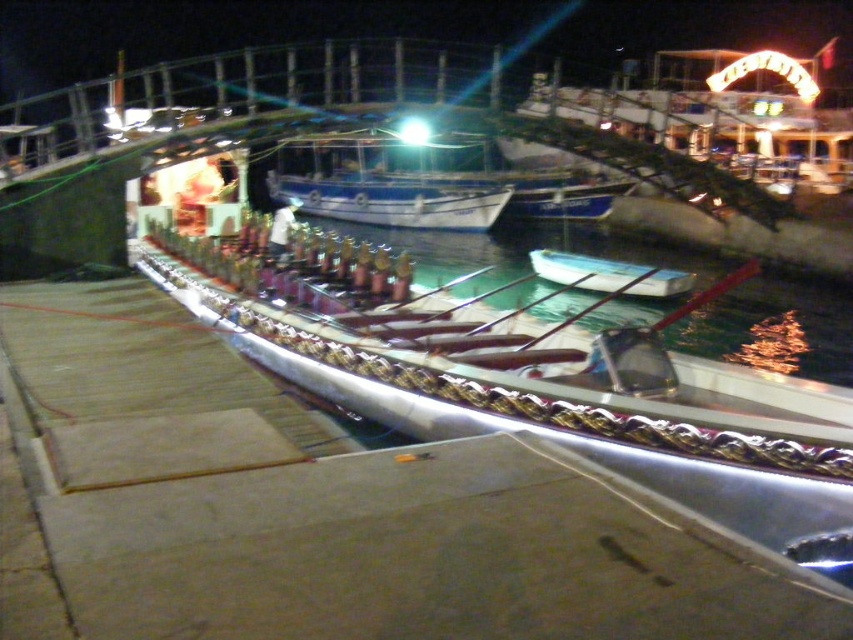
Does clear water at center lie in front of blue glossy boat at center?

Yes, clear water at center is in front of blue glossy boat at center.

Between point (581, 248) and point (415, 220), which one is positioned in front?

Point (581, 248)

Where is `clear water at center`? This screenshot has height=640, width=853. clear water at center is located at coordinates (775, 328).

Who is positioned more to the left, blue glossy boat at center or white glossy boat at center?

Positioned to the left is blue glossy boat at center.

Measure the distance between blue glossy boat at center and white glossy boat at center.

A distance of 10.92 meters exists between blue glossy boat at center and white glossy boat at center.

Image resolution: width=853 pixels, height=640 pixels. What do you see at coordinates (434, 180) in the screenshot? I see `blue glossy boat at center` at bounding box center [434, 180].

Image resolution: width=853 pixels, height=640 pixels. Find the location of `blue glossy boat at center`. blue glossy boat at center is located at coordinates (434, 180).

Does clear water at center lie behind white glossy boat at center?

No, it is in front of white glossy boat at center.

Describe the element at coordinates (775, 328) in the screenshot. The width and height of the screenshot is (853, 640). I see `clear water at center` at that location.

You are a GUI agent. You are given a task and a screenshot of the screen. Output one action in this format:
    pyautogui.click(x=<x>, y=<y>)
    Task: Click on the clear water at center
    
    Given the screenshot: What is the action you would take?
    pyautogui.click(x=775, y=328)